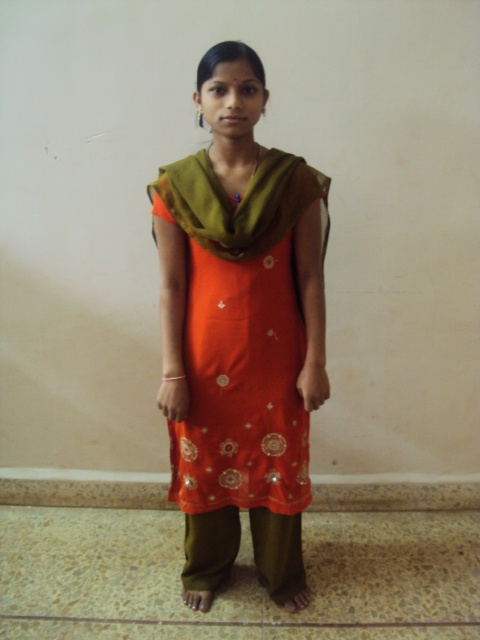
Question: Can you confirm if orange satin kurta at center is smaller than green sheer scarf at upper center?

Choices:
 (A) yes
 (B) no

Answer: (B)

Question: Can you confirm if orange satin kurta at center is positioned to the right of green sheer scarf at upper center?

Choices:
 (A) yes
 (B) no

Answer: (B)

Question: Which point appears farthest from the camera in this image?

Choices:
 (A) (167, 168)
 (B) (256, 456)

Answer: (B)

Question: Which point is closer to the camera taking this photo?

Choices:
 (A) (217, 244)
 (B) (271, 148)

Answer: (A)

Question: Among these points, which one is nearest to the camera?

Choices:
 (A) (257, 209)
 (B) (220, 532)

Answer: (A)

Question: Is orange satin kurta at center below green sheer scarf at upper center?

Choices:
 (A) yes
 (B) no

Answer: (A)